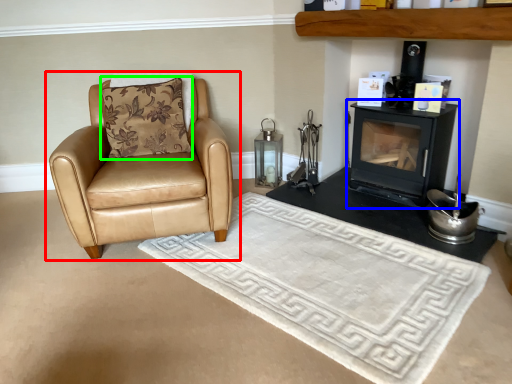
Question: Based on their relative distances, which object is nearer to chair (highlighted by a red box)? Choose from wood burning stove (highlighted by a blue box) and pillow (highlighted by a green box).

Choices:
 (A) wood burning stove
 (B) pillow

Answer: (B)